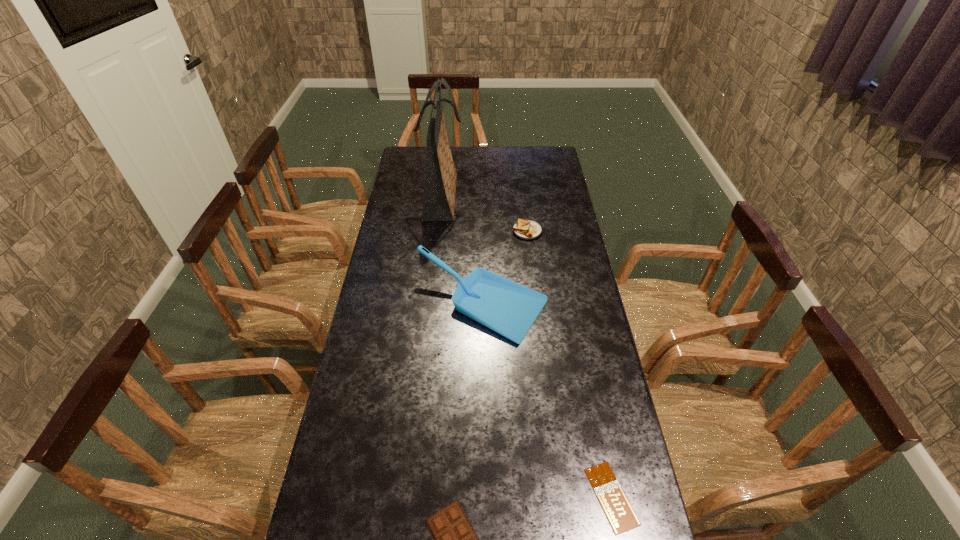
At what (x,y) coordinates should I click in order to perform the action: click on vacant region between the shorter chocolate bar and the farthest object. Please return your answer as a coordinate pair (x, y). This screenshot has width=960, height=540. Looking at the image, I should click on (527, 346).

I want to click on vacant space that's between the shortest object and the sandwich, so click(x=569, y=364).

Find the location of `free space between the farthest object and the rightmost object`. free space between the farthest object and the rightmost object is located at coordinates (527, 346).

I want to click on free area in between the second farthest object and the shortest object, so click(x=569, y=364).

What are the coordinates of `free space between the farthest object and the third farthest object` in the screenshot? It's located at (462, 251).

Locate which object ranks second in proximity to the farthest object. Please provide its 2D coordinates. Your answer should be formatted as a tuple, i.e. [(x, y)], where the tuple contains the x and y coordinates of a point satisfying the conditions above.

[(506, 307)]

Locate which object ranks fourth in proximity to the taller chocolate bar. Please provide its 2D coordinates. Your answer should be formatted as a tuple, i.e. [(x, y)], where the tuple contains the x and y coordinates of a point satisfying the conditions above.

[(440, 185)]

You are a GUI agent. You are given a task and a screenshot of the screen. Output one action in this format:
    pyautogui.click(x=<x>, y=<y>)
    Task: Click on the free space that satisfies the following two spatial constraints: 1. on the front-facing side of the shopping bag; 2. on the left side of the shortest object
    
    Given the screenshot: What is the action you would take?
    pyautogui.click(x=411, y=496)

The image size is (960, 540). I want to click on free point that satisfies the following two spatial constraints: 1. on the front-facing side of the sandwich; 2. on the right side of the farthest object, so [x=439, y=231].

Find the location of a particular element. free space that satisfies the following two spatial constraints: 1. on the back side of the third nearest object; 2. on the front-facing side of the farthest object is located at coordinates (482, 196).